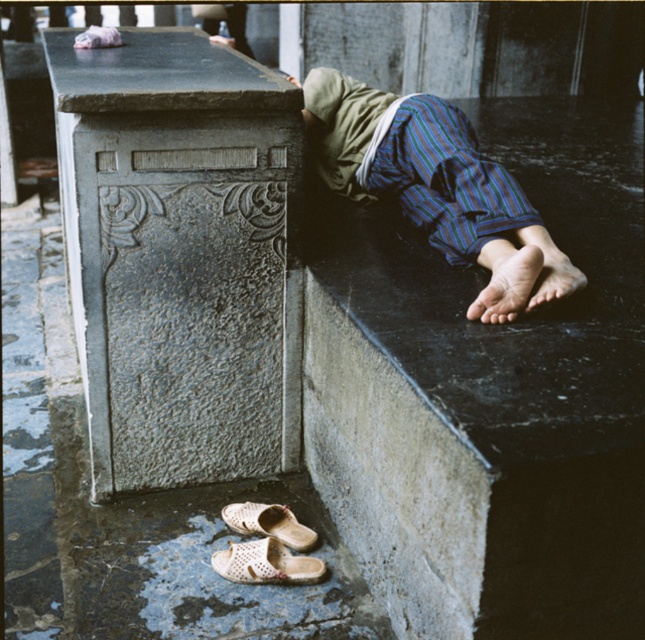
You are a photographer trying to capture the foot and sandal in the scene. Since the dry skin foot at lower right and white woven sandal at lower center are both in view, which one appears larger in the photo?

The dry skin foot at lower right is much taller than the white woven sandal at lower center, so it will appear larger in the photo.

You are a construction worker checking the stability of the black marble concrete at upper right and the striped fabric legs at lower right. Which object is supporting the other?

The black marble concrete at upper right is positioned under striped fabric legs at lower right, so it is supporting the striped fabric legs at lower right.